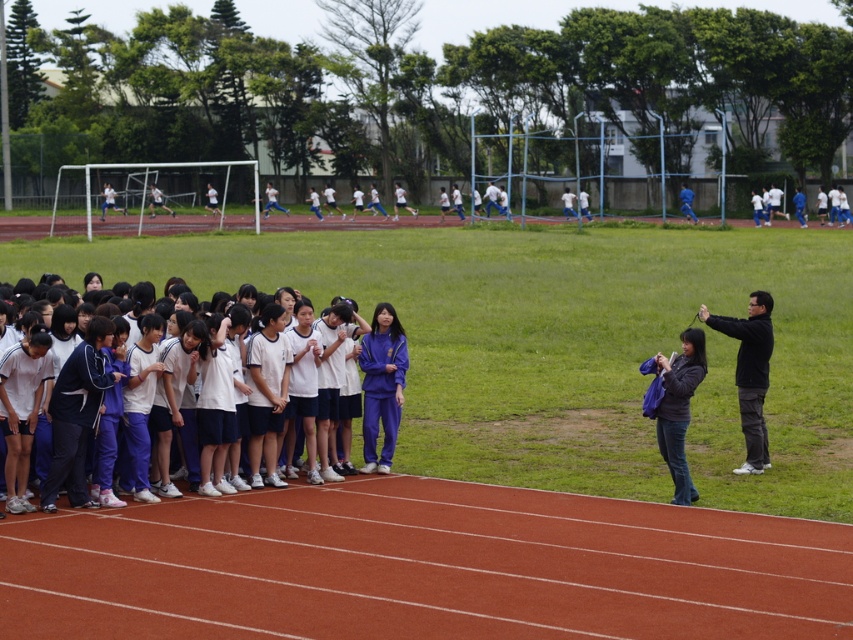
Which is more to the right, green grass football field at center or white fabric uniform at center?

green grass football field at center is more to the right.

Which of these two, green grass football field at center or white fabric uniform at center, stands shorter?

With less height is white fabric uniform at center.

Between point (253, 573) and point (242, 481), which one is positioned behind?

The point (242, 481) is behind.

Identify the location of green grass football field at center. The width and height of the screenshot is (853, 640). (495, 449).

Between point (339, 612) and point (666, 426), which one is positioned in front?

Point (339, 612)

Image resolution: width=853 pixels, height=640 pixels. What are the coordinates of `smooth red track at lower center` in the screenshot? It's located at (422, 566).

Find the location of a particular element. This screenshot has width=853, height=640. black matte jacket at right is located at coordinates (749, 372).

Does black matte jacket at right appear on the left side of dark gray denim jacket at lower right?

No, black matte jacket at right is not to the left of dark gray denim jacket at lower right.

The height and width of the screenshot is (640, 853). I want to click on black matte jacket at right, so click(749, 372).